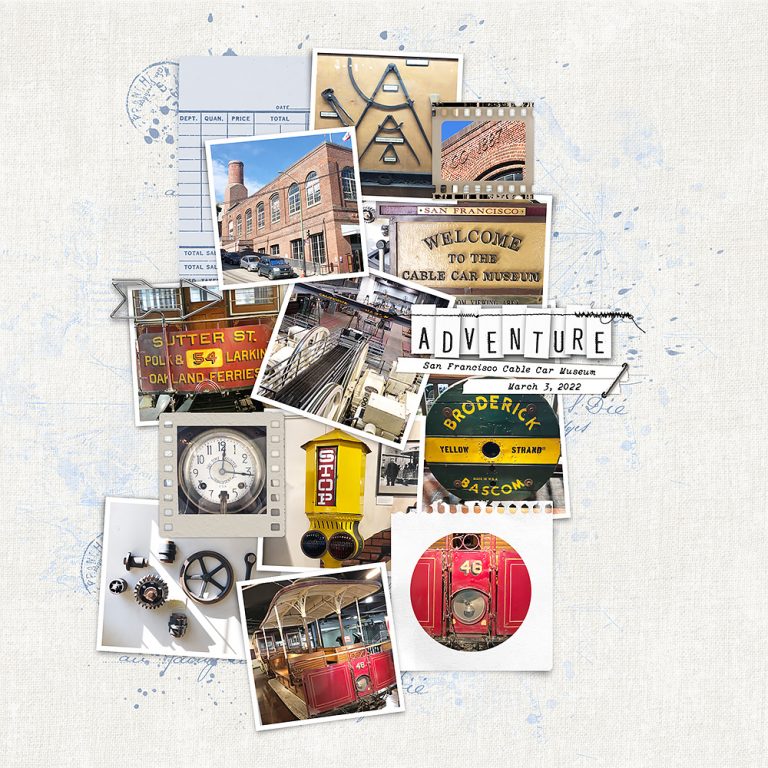
You are a GUI agent. You are given a task and a screenshot of the screen. Output one action in this format:
    pyautogui.click(x=<x>, y=<y>)
    Task: Click on the white border pic of welcome sign
    This screenshot has width=768, height=768.
    Given the screenshot: What is the action you would take?
    pyautogui.click(x=425, y=249)